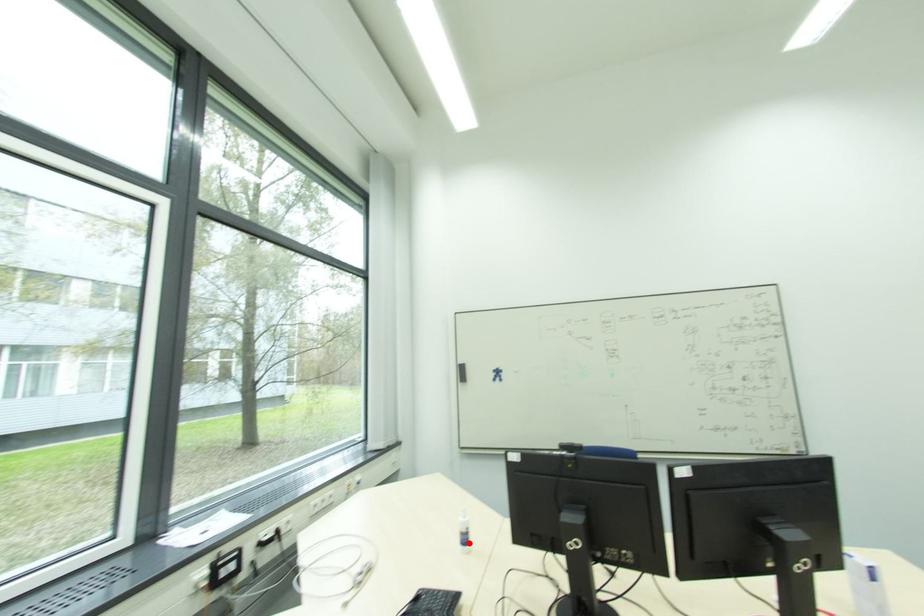
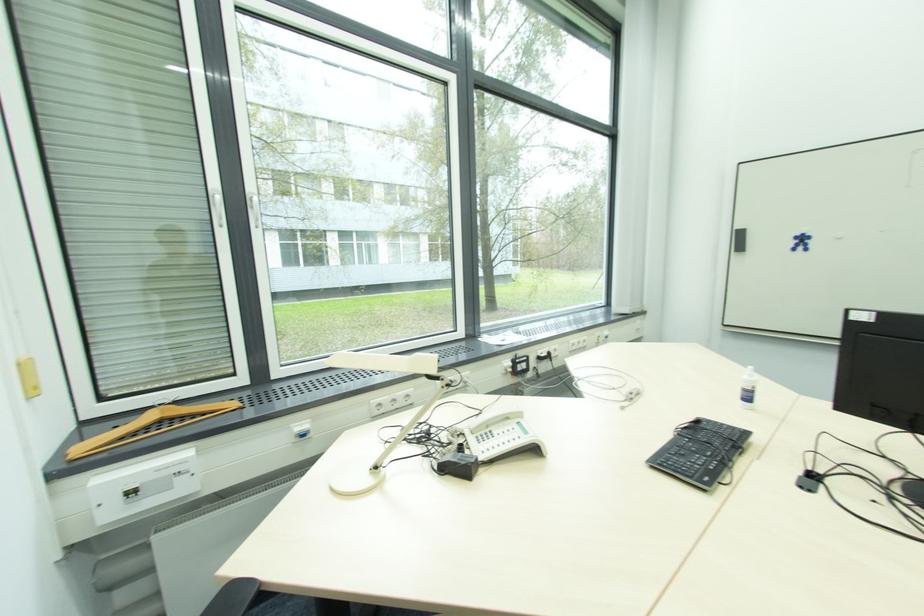
The point at the highlighted location is marked in the first image. Where is the corresponding point in the second image?

(750, 400)